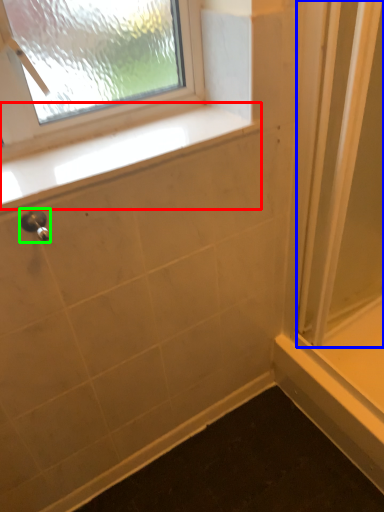
Question: Which is farther away from window sill (highlighted by a red box)? screen door (highlighted by a blue box) or shower (highlighted by a green box)?

Choices:
 (A) screen door
 (B) shower

Answer: (A)